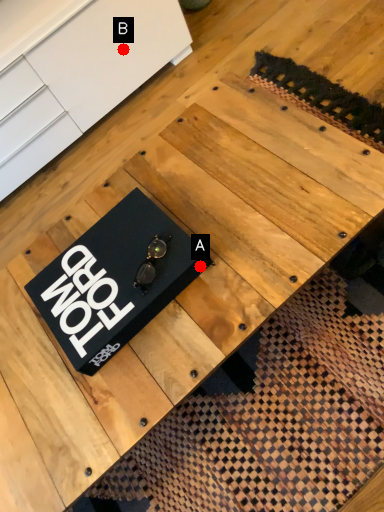
Question: Two points are circled on the image, labeled by A and B beside each circle. Which point appears farthest from the camera in this image?

Choices:
 (A) A is further
 (B) B is further

Answer: (B)